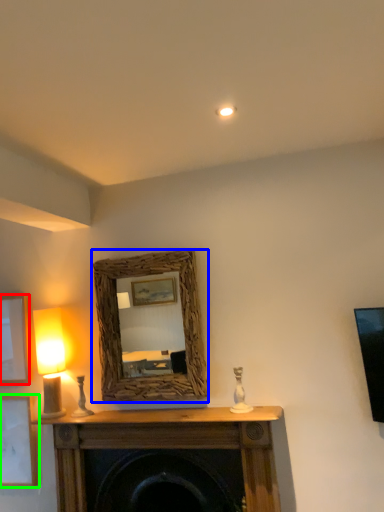
Question: Estimate the real-world distances between objects in this image. Which object is closer to picture frame (highlighted by a red box), mirror (highlighted by a blue box) or picture frame (highlighted by a green box)?

Choices:
 (A) mirror
 (B) picture frame

Answer: (B)